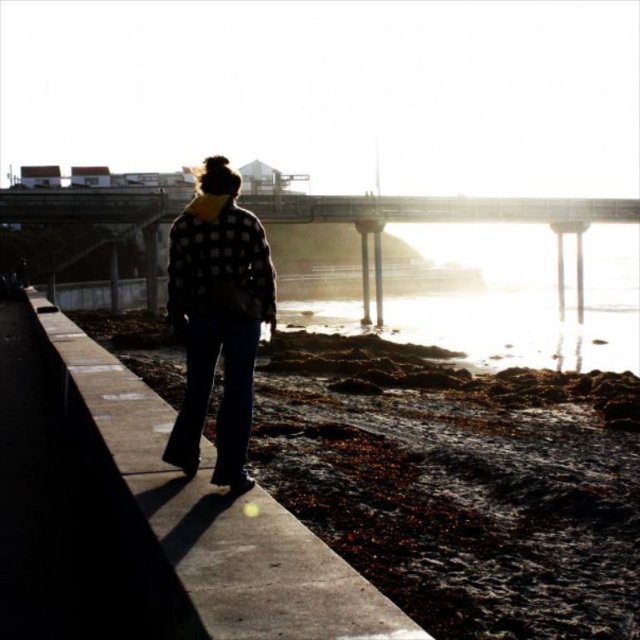
Question: From the image, what is the correct spatial relationship of concrete at center in relation to checkered fabric jacket at center?

Choices:
 (A) above
 (B) below

Answer: (A)

Question: Which point is farther to the camera?

Choices:
 (A) checkered fabric jacket at center
 (B) concrete at center

Answer: (A)

Question: Is concrete at center above checkered fabric jacket at center?

Choices:
 (A) yes
 (B) no

Answer: (A)

Question: Which point appears closest to the camera in this image?

Choices:
 (A) (276, 636)
 (B) (241, 212)

Answer: (A)

Question: Can you confirm if concrete at center is bigger than checkered fabric jacket at center?

Choices:
 (A) no
 (B) yes

Answer: (B)

Question: Which of the following is the closest to the observer?

Choices:
 (A) (92, 344)
 (B) (225, 417)

Answer: (B)